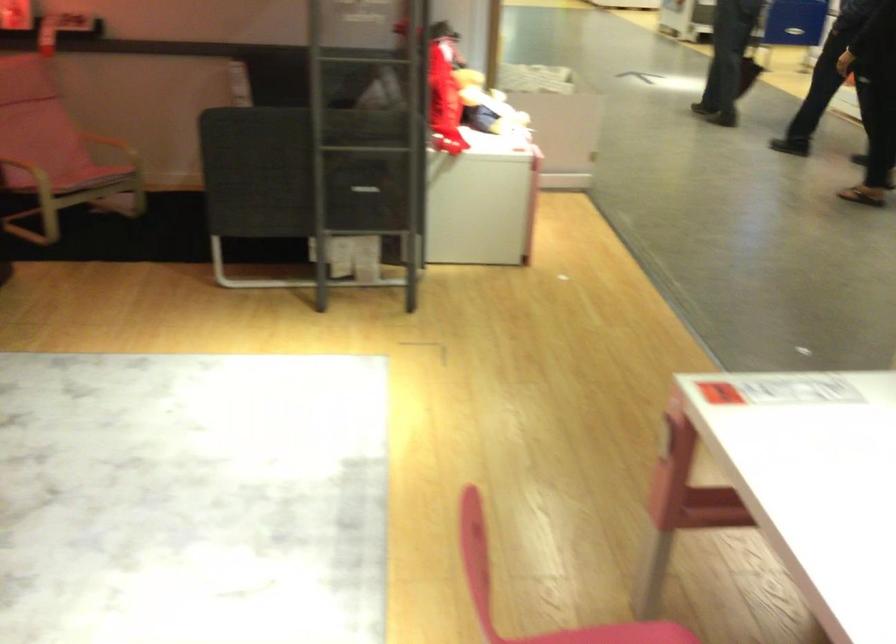
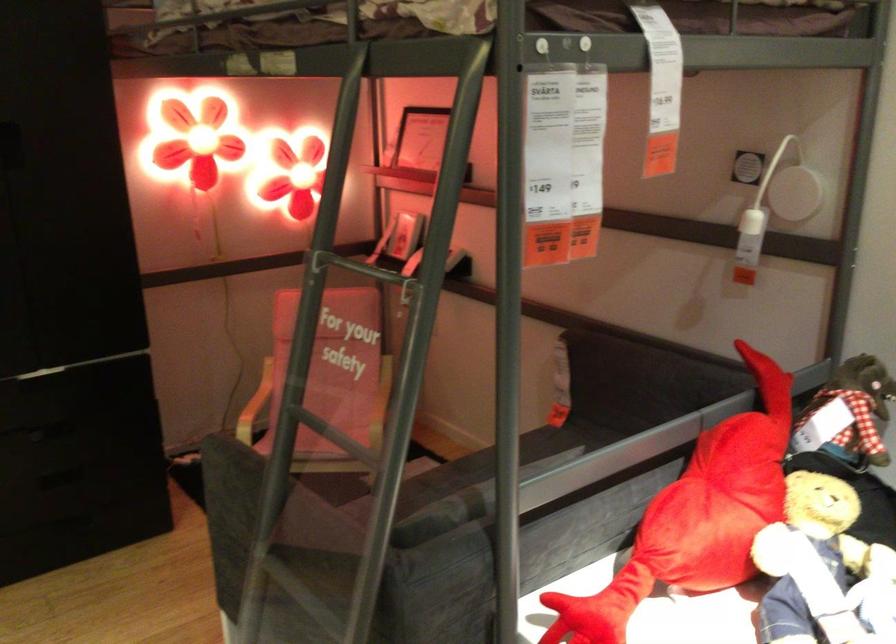
In the second image, find the point that corresponds to pixel 346 183 in the first image.

(293, 609)